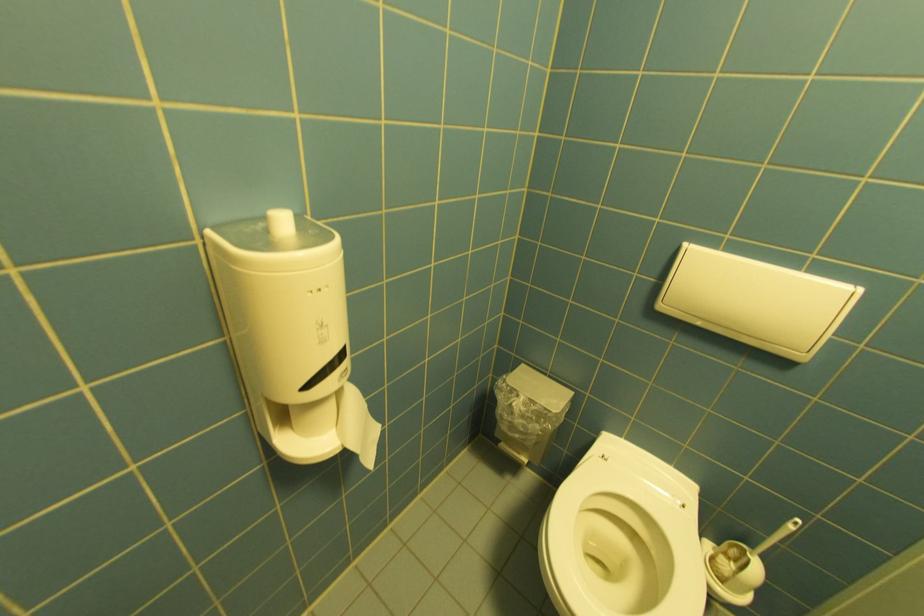
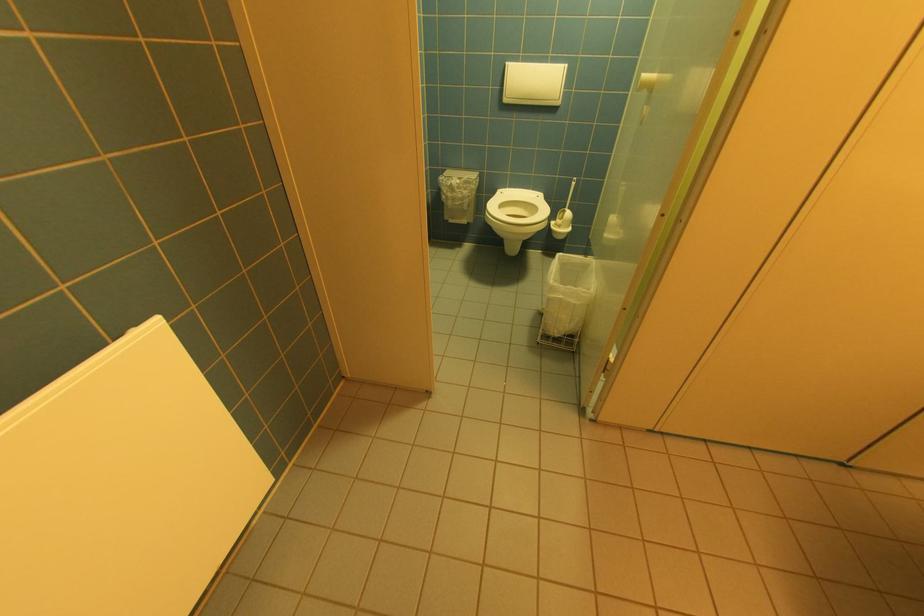
Where in the second image is the point corresponding to point (633, 440) from the first image?

(515, 188)